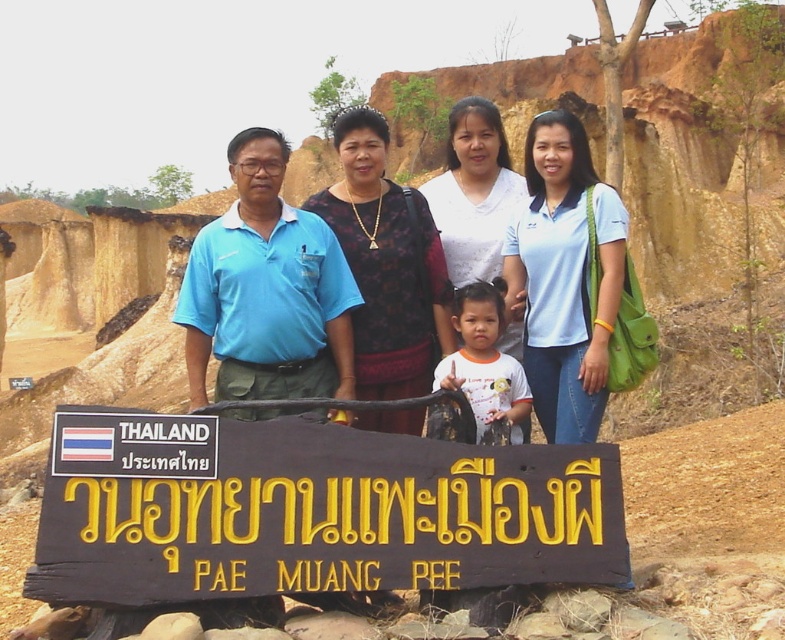
Which is more to the right, black wood sign at lower center or matte blue shirt at center?

black wood sign at lower center is more to the right.

Locate an element on the screen. black wood sign at lower center is located at coordinates (309, 509).

Is point (225, 588) less distant than point (457, 352)?

That is True.

How distant is black wood sign at lower center from white matte shirt at center?

4.74 meters

This screenshot has height=640, width=785. What are the coordinates of `black wood sign at lower center` in the screenshot? It's located at 309,509.

Image resolution: width=785 pixels, height=640 pixels. In order to click on black wood sign at lower center in this screenshot , I will do `click(309, 509)`.

Is matte blue shirt at center thinner than white matte shirt at center?

Incorrect, matte blue shirt at center's width is not less than white matte shirt at center's.

Between matte blue shirt at center and white matte shirt at center, which one is positioned higher?

Positioned higher is matte blue shirt at center.

Describe the element at coordinates (385, 262) in the screenshot. The width and height of the screenshot is (785, 640). I see `matte blue shirt at center` at that location.

This screenshot has width=785, height=640. I want to click on matte blue shirt at center, so (x=385, y=262).